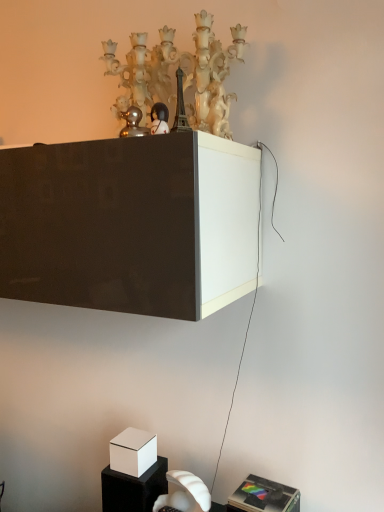
Question: From the image's perspective, is matte white chandelier at upper center located above matte black figurine at upper center?

Choices:
 (A) yes
 (B) no

Answer: (A)

Question: Is matte black figurine at upper center at the back of matte white chandelier at upper center?

Choices:
 (A) no
 (B) yes

Answer: (A)

Question: Is matte white chandelier at upper center outside matte black figurine at upper center?

Choices:
 (A) no
 (B) yes

Answer: (B)

Question: Is matte white chandelier at upper center aimed at matte black figurine at upper center?

Choices:
 (A) no
 (B) yes

Answer: (B)

Question: Is matte white chandelier at upper center positioned behind matte black figurine at upper center?

Choices:
 (A) no
 (B) yes

Answer: (B)

Question: Based on their sizes in the image, would you say metallic silver speaker at lower right, the 1th furniture when ordered from front to back, is bigger or smaller than matte black figurine at upper center?

Choices:
 (A) big
 (B) small

Answer: (A)

Question: Considering the relative positions of metallic silver speaker at lower right, acting as the 2th furniture starting from the back, and matte black figurine at upper center in the image provided, is metallic silver speaker at lower right, acting as the 2th furniture starting from the back, to the left or to the right of matte black figurine at upper center?

Choices:
 (A) left
 (B) right

Answer: (B)

Question: Considering the positions of metallic silver speaker at lower right, which appears as the second furniture when viewed from the left, and matte black figurine at upper center in the image, is metallic silver speaker at lower right, which appears as the second furniture when viewed from the left, wider or thinner than matte black figurine at upper center?

Choices:
 (A) wide
 (B) thin

Answer: (A)

Question: From the image's perspective, is metallic silver speaker at lower right, the 1th furniture when ordered from front to back, positioned above or below matte black figurine at upper center?

Choices:
 (A) above
 (B) below

Answer: (B)

Question: Is white matte box at lower left in front of or behind metallic silver speaker at lower right, which appears as the second furniture when viewed from the left, in the image?

Choices:
 (A) front
 (B) behind

Answer: (B)

Question: Which is correct: white matte box at lower left is inside metallic silver speaker at lower right, positioned as the 1th furniture in right-to-left order, or outside of it?

Choices:
 (A) inside
 (B) outside

Answer: (B)

Question: Considering the positions of white matte box at lower left and metallic silver speaker at lower right, acting as the 2th furniture starting from the back, in the image, is white matte box at lower left taller or shorter than metallic silver speaker at lower right, acting as the 2th furniture starting from the back,?

Choices:
 (A) short
 (B) tall

Answer: (A)

Question: From the image's perspective, is white matte box at lower left positioned above or below metallic silver speaker at lower right, the 1th furniture when ordered from front to back?

Choices:
 (A) below
 (B) above

Answer: (B)

Question: Is white matte box at lower left inside the boundaries of matte white chandelier at upper center, or outside?

Choices:
 (A) inside
 (B) outside

Answer: (B)

Question: In the image, is white matte box at lower left on the left side or the right side of matte white chandelier at upper center?

Choices:
 (A) left
 (B) right

Answer: (A)